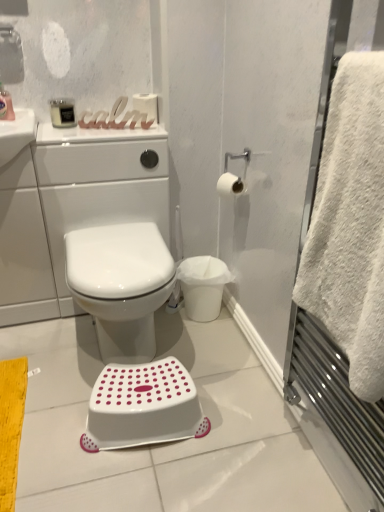
This screenshot has height=512, width=384. I want to click on vacant area on top of white glossy bidet at center (from a real-world perspective), so click(125, 248).